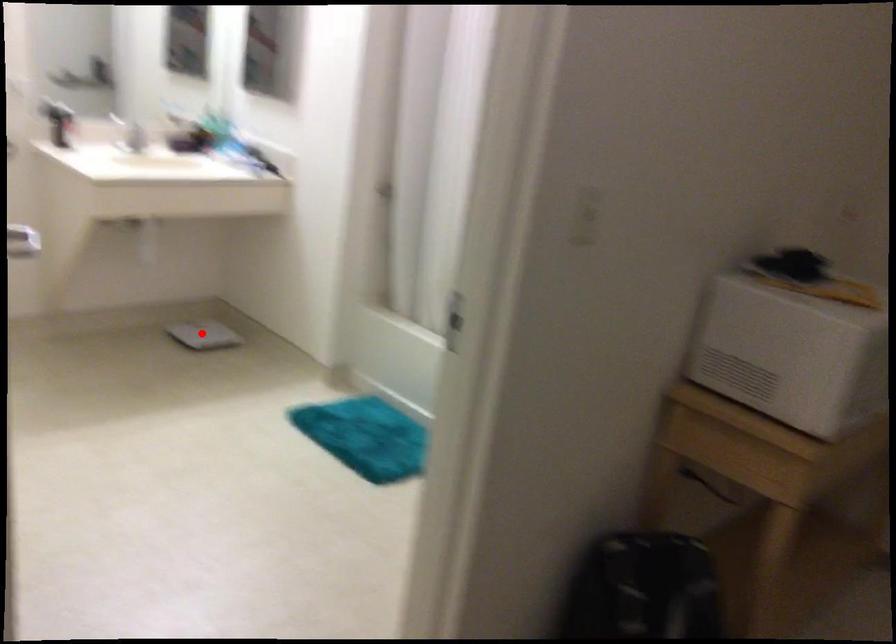
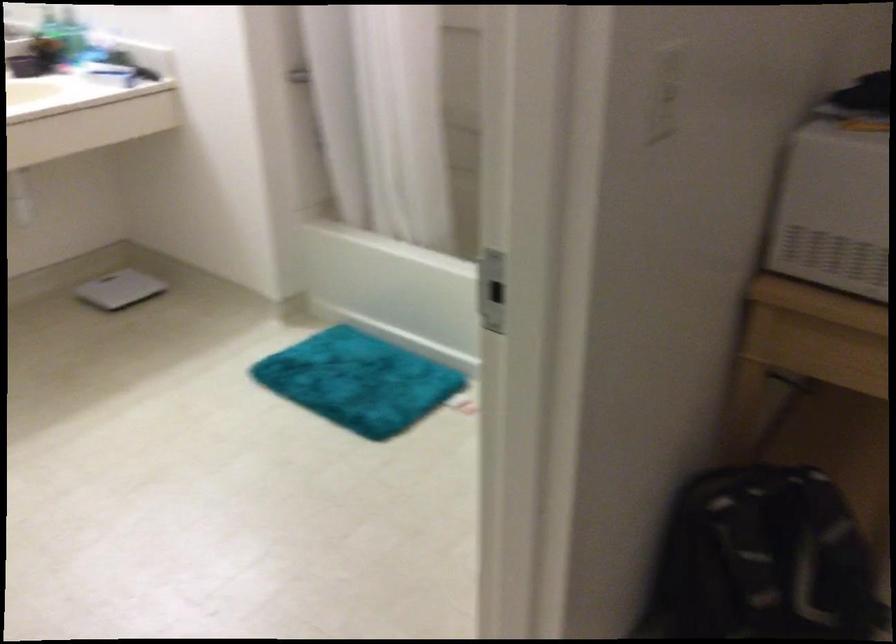
Question: I am providing you with two images of the same scene from different viewpoints. A red point is marked on the first image. Is the red point's position out of view in image 2?

Choices:
 (A) Yes
 (B) No

Answer: (B)